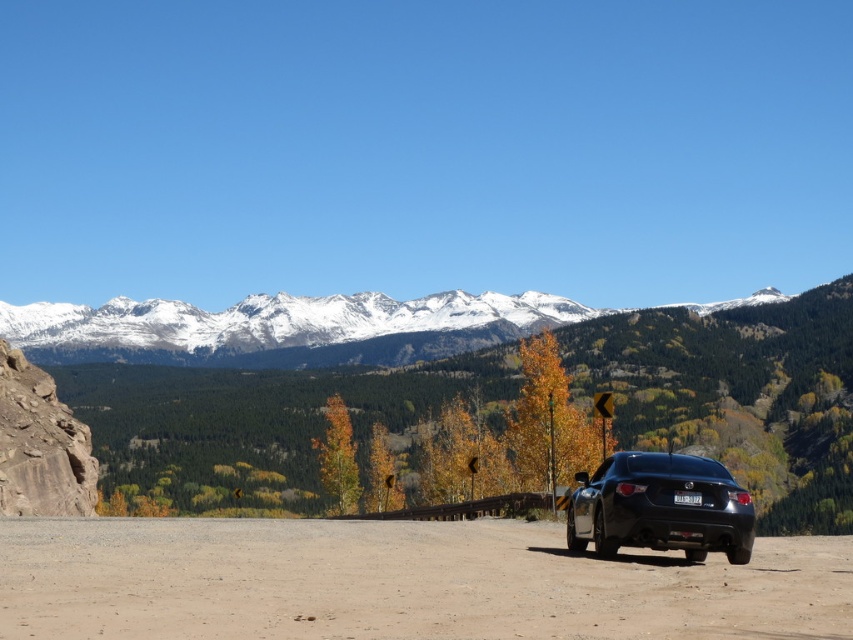
Question: In this image, where is dirt/gravel road at lower center located relative to snowy granite mountain range at upper center?

Choices:
 (A) right
 (B) left

Answer: (A)

Question: Can you confirm if snowy granite mountain range at upper center is positioned above black matte car at right?

Choices:
 (A) yes
 (B) no

Answer: (A)

Question: Which point is closer to the camera taking this photo?

Choices:
 (A) (389, 353)
 (B) (706, 500)

Answer: (B)

Question: Among these points, which one is nearest to the camera?

Choices:
 (A) (410, 353)
 (B) (497, 520)

Answer: (B)

Question: Which point is farther to the camera?

Choices:
 (A) dirt/gravel road at lower center
 (B) snowy granite mountain range at upper center
 (C) black matte car at right

Answer: (B)

Question: Can you confirm if dirt/gravel road at lower center is positioned to the right of black matte car at right?

Choices:
 (A) yes
 (B) no

Answer: (B)